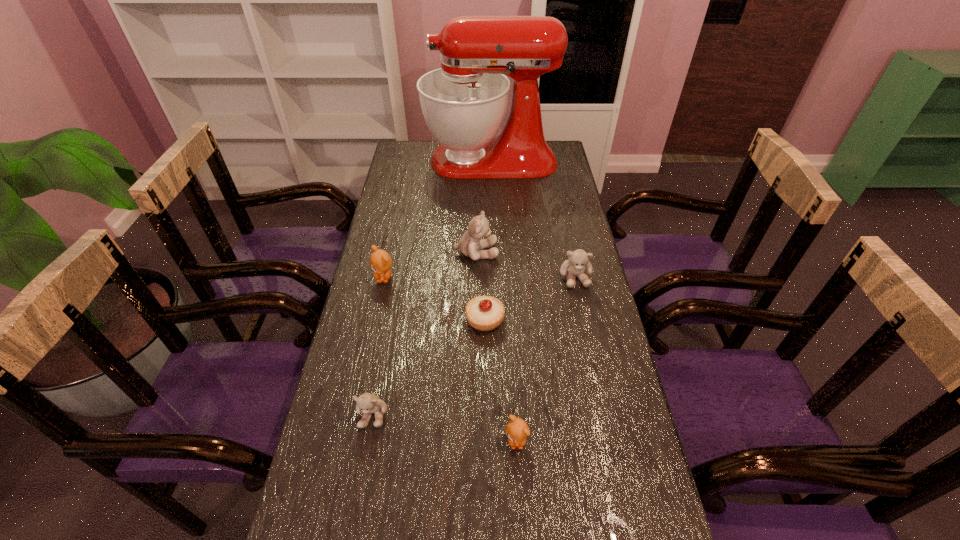
Find the location of `the leftmost gray teddy bear`. the leftmost gray teddy bear is located at coordinates (368, 403).

Where is `the nearest gray teddy bear`? Image resolution: width=960 pixels, height=540 pixels. the nearest gray teddy bear is located at coordinates (368, 403).

The image size is (960, 540). In order to click on pastry in this screenshot , I will do `click(484, 313)`.

You are a GUI agent. You are given a task and a screenshot of the screen. Output one action in this format:
    pyautogui.click(x=<x>, y=<y>)
    Task: Click on the third nearest object
    
    Given the screenshot: What is the action you would take?
    pyautogui.click(x=484, y=313)

Image resolution: width=960 pixels, height=540 pixels. Find the location of `free point located at the attachment hub of the tallest object`. free point located at the attachment hub of the tallest object is located at coordinates (406, 161).

The width and height of the screenshot is (960, 540). Find the location of `free space located 0.070m on the face of the second gray teddy bear from left to right`. free space located 0.070m on the face of the second gray teddy bear from left to right is located at coordinates (519, 252).

The height and width of the screenshot is (540, 960). I want to click on vacant space situated 0.290m on the face of the bigger brown teddy bear, so click(x=365, y=364).

I want to click on vacant area situated on the face of the rightmost gray teddy bear, so click(599, 389).

Locate an element on the screen. The height and width of the screenshot is (540, 960). free space located on the face of the smaller brown teddy bear is located at coordinates (521, 524).

You are a GUI agent. You are given a task and a screenshot of the screen. Output one action in this format:
    pyautogui.click(x=<x>, y=<y>)
    Task: Click on the vacant space located 0.130m on the face of the smallest gray teddy bear
    This screenshot has height=540, width=960.
    Given the screenshot: What is the action you would take?
    pyautogui.click(x=359, y=489)